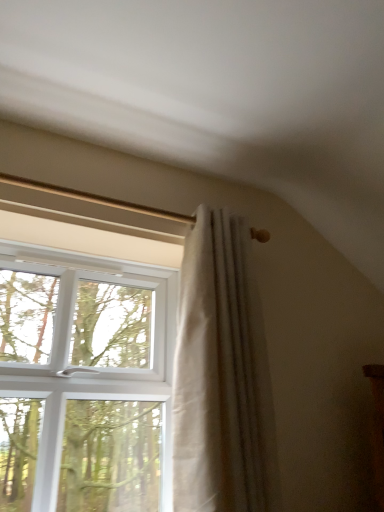
Question: Is white plastic window at upper left in front of or behind white textured curtain at center in the image?

Choices:
 (A) behind
 (B) front

Answer: (B)

Question: Considering the positions of white plastic window at upper left and white textured curtain at center in the image, is white plastic window at upper left bigger or smaller than white textured curtain at center?

Choices:
 (A) small
 (B) big

Answer: (B)

Question: From a real-world perspective, is white plastic window at upper left above or below white textured curtain at center?

Choices:
 (A) below
 (B) above

Answer: (A)

Question: Based on their sizes in the image, would you say white textured curtain at center is bigger or smaller than white plastic window at upper left?

Choices:
 (A) big
 (B) small

Answer: (B)

Question: In terms of width, does white textured curtain at center look wider or thinner when compared to white plastic window at upper left?

Choices:
 (A) thin
 (B) wide

Answer: (A)

Question: Is point (248, 331) closer or farther from the camera than point (135, 471)?

Choices:
 (A) farther
 (B) closer

Answer: (B)

Question: From the image's perspective, is white textured curtain at center located above or below white plastic window at upper left?

Choices:
 (A) above
 (B) below

Answer: (A)